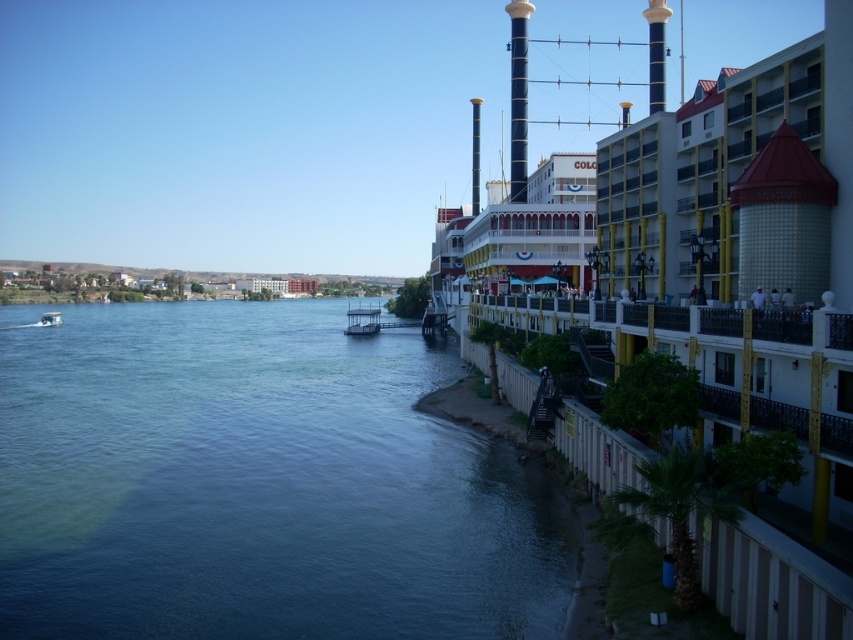
Which is above, blue water at lower left or white plastic boat at lower left?

white plastic boat at lower left is above.

Is blue water at lower left bigger than white plastic boat at lower left?

Yes.

Is point (79, 429) closer to viewer compared to point (56, 314)?

Yes, it is in front of point (56, 314).

Where is `blue water at lower left`? blue water at lower left is located at coordinates (257, 483).

Who is taller, blue water at lower left or white glossy boat at center?

With more height is blue water at lower left.

This screenshot has width=853, height=640. What do you see at coordinates (257, 483) in the screenshot?
I see `blue water at lower left` at bounding box center [257, 483].

You are a GUI agent. You are given a task and a screenshot of the screen. Output one action in this format:
    pyautogui.click(x=<x>, y=<y>)
    Task: Click on the blue water at lower left
    
    Given the screenshot: What is the action you would take?
    pyautogui.click(x=257, y=483)

Is point (361, 321) less distant than point (45, 324)?

Yes, point (361, 321) is in front of point (45, 324).

Which of these two, white glossy boat at center or white plastic boat at lower left, stands taller?

white glossy boat at center

Which is in front, point (376, 312) or point (45, 316)?

Point (45, 316) is in front.

Find the location of a particular element. The width and height of the screenshot is (853, 640). white glossy boat at center is located at coordinates (363, 321).